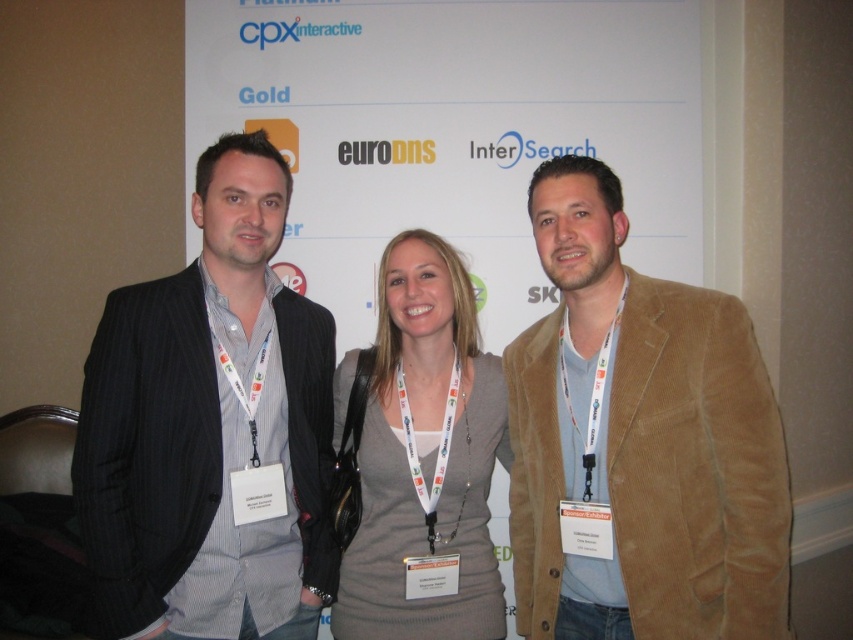
Is corduroy brown blazer at center to the right of white fabric lanyard at right from the viewer's perspective?

Yes, corduroy brown blazer at center is to the right of white fabric lanyard at right.

This screenshot has height=640, width=853. In order to click on corduroy brown blazer at center in this screenshot , I will do `click(639, 442)`.

Where is `corduroy brown blazer at center`? The image size is (853, 640). corduroy brown blazer at center is located at coordinates (639, 442).

Which is more to the left, gray knitted sweater at center or white fabric lanyard at right?

gray knitted sweater at center is more to the left.

Can you confirm if gray knitted sweater at center is shorter than white fabric lanyard at right?

No, gray knitted sweater at center is not shorter than white fabric lanyard at right.

Describe the element at coordinates (422, 458) in the screenshot. I see `gray knitted sweater at center` at that location.

This screenshot has height=640, width=853. What are the coordinates of `gray knitted sweater at center` in the screenshot? It's located at (422, 458).

Is corduroy brown blazer at center behind dark gray pinstripe suit at left?

No, corduroy brown blazer at center is closer to the viewer.

Can you confirm if corduroy brown blazer at center is shorter than dark gray pinstripe suit at left?

Yes, corduroy brown blazer at center is shorter than dark gray pinstripe suit at left.

Consider the image. Who is more forward, [695,497] or [180,316]?

Point [695,497] is in front.

Find the location of a particular element. corduroy brown blazer at center is located at coordinates (639, 442).